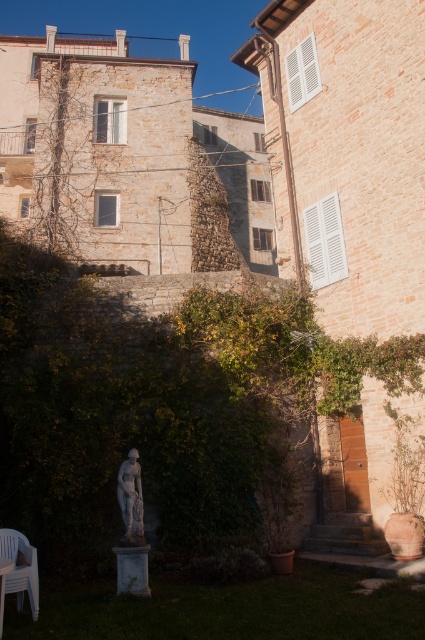
The width and height of the screenshot is (425, 640). What do you see at coordinates (20, 568) in the screenshot? I see `plastic chair at lower left` at bounding box center [20, 568].

Does point (2, 545) come farther from viewer compared to point (141, 520)?

No.

Locate an element on the screen. plastic chair at lower left is located at coordinates (20, 568).

Does green leafy hedge at center have a greater height compared to white plastic table at lower left?

Indeed, green leafy hedge at center has a greater height compared to white plastic table at lower left.

Between green leafy hedge at center and white plastic table at lower left, which one appears on the right side from the viewer's perspective?

From the viewer's perspective, white plastic table at lower left appears more on the right side.

Is point (348, 374) farther from viewer compared to point (0, 602)?

Yes, it is behind point (0, 602).

The height and width of the screenshot is (640, 425). Identify the location of green leafy hedge at center. (163, 404).

Which is more to the right, green leafy hedge at center or plastic chair at lower left?

plastic chair at lower left is more to the right.

Between green leafy hedge at center and plastic chair at lower left, which one is positioned lower?

plastic chair at lower left

Between point (73, 515) and point (33, 570), which one is positioned in front?

Positioned in front is point (33, 570).

You are a GUI agent. You are given a task and a screenshot of the screen. Output one action in this format:
    pyautogui.click(x=<x>, y=<y>)
    Task: Click on the green leafy hedge at center
    Image resolution: width=425 pixels, height=640 pixels.
    Given the screenshot: What is the action you would take?
    pyautogui.click(x=163, y=404)